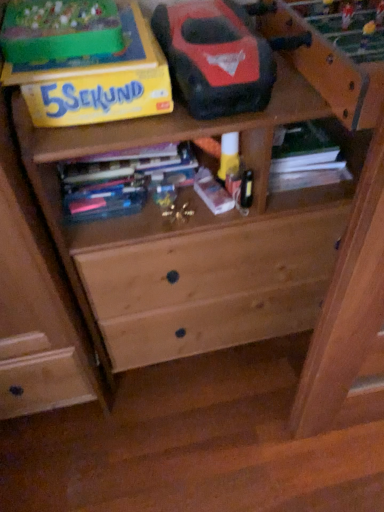
Question: Considering the relative sizes of matte plastic book at center, placed as the second book when sorted from left to right, and multicolored paperbacks at center, placed as the third book when sorted from right to left, in the image provided, is matte plastic book at center, placed as the second book when sorted from left to right, shorter than multicolored paperbacks at center, placed as the third book when sorted from right to left,?

Choices:
 (A) yes
 (B) no

Answer: (A)

Question: From a real-world perspective, is matte plastic book at center, placed as the second book when sorted from left to right, below multicolored paperbacks at center, which is the 1th book in left-to-right order?

Choices:
 (A) yes
 (B) no

Answer: (A)

Question: Is matte plastic book at center, the second book from the right, positioned far away from multicolored paperbacks at center, which is the 1th book in left-to-right order?

Choices:
 (A) no
 (B) yes

Answer: (A)

Question: Is matte plastic book at center, the second book from the right, bigger than multicolored paperbacks at center, which is the 1th book in left-to-right order?

Choices:
 (A) no
 (B) yes

Answer: (A)

Question: Is matte plastic book at center, placed as the second book when sorted from left to right, next to multicolored paperbacks at center, which is the 1th book in left-to-right order?

Choices:
 (A) yes
 (B) no

Answer: (B)

Question: In terms of width, does multicolored paperbacks at center, which is the 1th book in left-to-right order, look wider or thinner when compared to green matte book at upper right, which is the third book in left-to-right order?

Choices:
 (A) wide
 (B) thin

Answer: (B)

Question: Is point 125,173 closer or farther from the camera than point 291,159?

Choices:
 (A) farther
 (B) closer

Answer: (B)

Question: Looking at the image, does multicolored paperbacks at center, which is the 1th book in left-to-right order, seem bigger or smaller compared to green matte book at upper right, which is the third book in left-to-right order?

Choices:
 (A) small
 (B) big

Answer: (B)

Question: From a real-world perspective, is multicolored paperbacks at center, placed as the third book when sorted from right to left, positioned above or below green matte book at upper right, the 1th book positioned from the right?

Choices:
 (A) below
 (B) above

Answer: (B)

Question: Looking at the image, does yellow cardboard box at upper left seem bigger or smaller compared to green matte book at upper right, the 1th book positioned from the right?

Choices:
 (A) small
 (B) big

Answer: (B)

Question: Would you say yellow cardboard box at upper left is inside or outside green matte book at upper right, which is the third book in left-to-right order?

Choices:
 (A) outside
 (B) inside

Answer: (A)

Question: Looking at their shapes, would you say yellow cardboard box at upper left is wider or thinner than green matte book at upper right, the 1th book positioned from the right?

Choices:
 (A) wide
 (B) thin

Answer: (A)

Question: In the image, is yellow cardboard box at upper left positioned in front of or behind green matte book at upper right, which is the third book in left-to-right order?

Choices:
 (A) behind
 (B) front

Answer: (B)

Question: From the image's perspective, is yellow cardboard box at upper left above or below multicolored paperbacks at center, placed as the third book when sorted from right to left?

Choices:
 (A) above
 (B) below

Answer: (A)

Question: Visually, is yellow cardboard box at upper left positioned to the left or to the right of multicolored paperbacks at center, placed as the third book when sorted from right to left?

Choices:
 (A) right
 (B) left

Answer: (B)